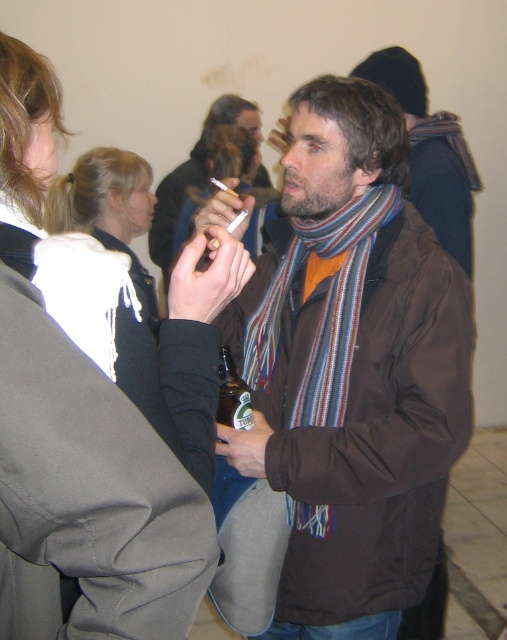
You are standing at the center of the image and want to hand a gift to the person wearing the white fleece jacket at upper left. In which general direction should you move to reach them?

The white fleece jacket at upper left is located at point 0.683 on the x and 0.152 on the y axis. Since you are at the center, you should move towards the upper left direction to reach them.

You are at a party and need to decide which jacket to take. The brown matte jacket at center is wider than the white fleece jacket at upper left. Which jacket has a larger width?

The brown matte jacket at center has a larger width than the white fleece jacket at upper left.

You are at a party and need to locate two white items at the upper left corner of the scene. Which one is positioned to the right between the white fleece jacket at upper left and the white fabric scarf at upper left?

The white fleece jacket at upper left is positioned to the right of the white fabric scarf at upper left.